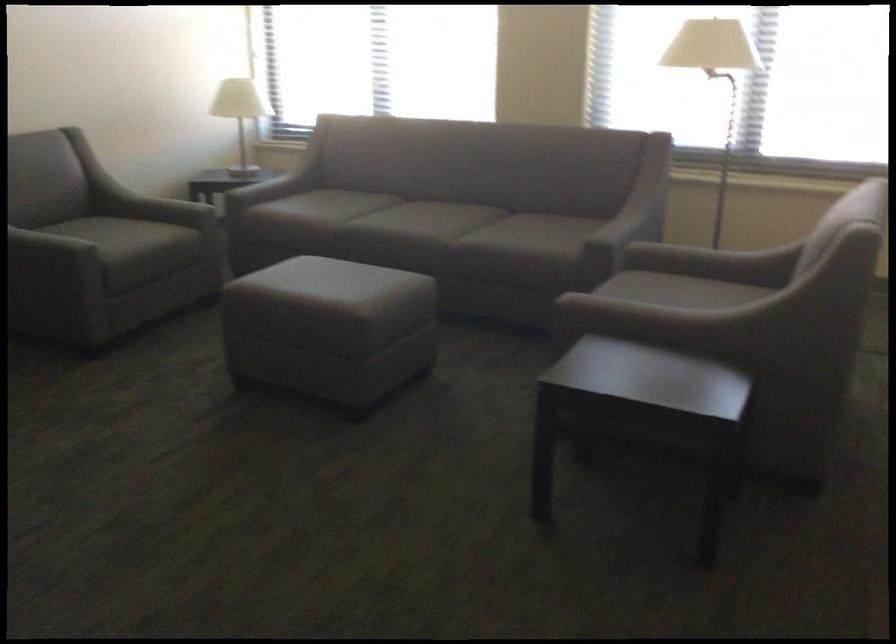
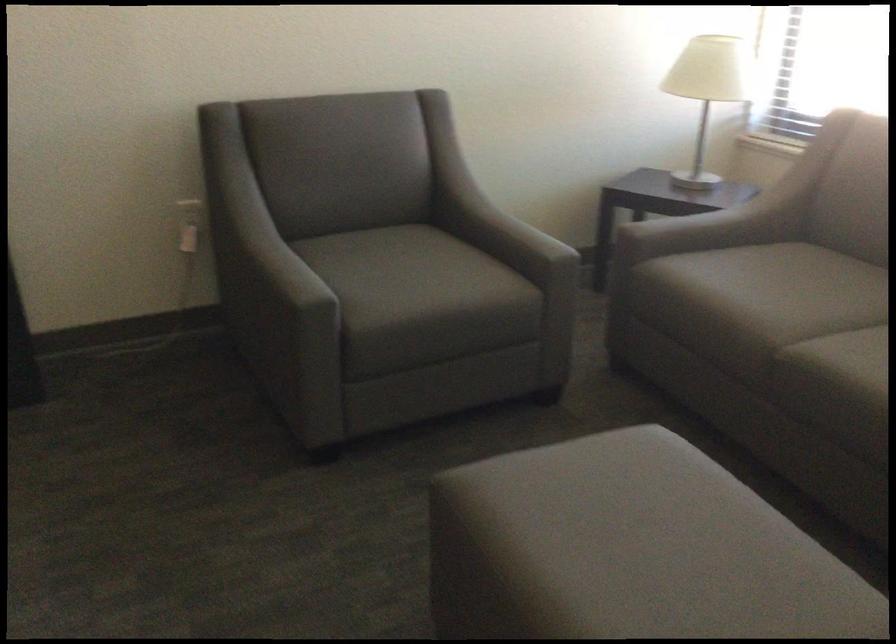
Question: I am providing you with two images of the same scene from different viewpoints. Which of the following objects are not visible in image2?

Choices:
 (A) white electrical outlet
 (B) chair sitting surface
 (C) grey chair armrest
 (D) none of these

Answer: (D)